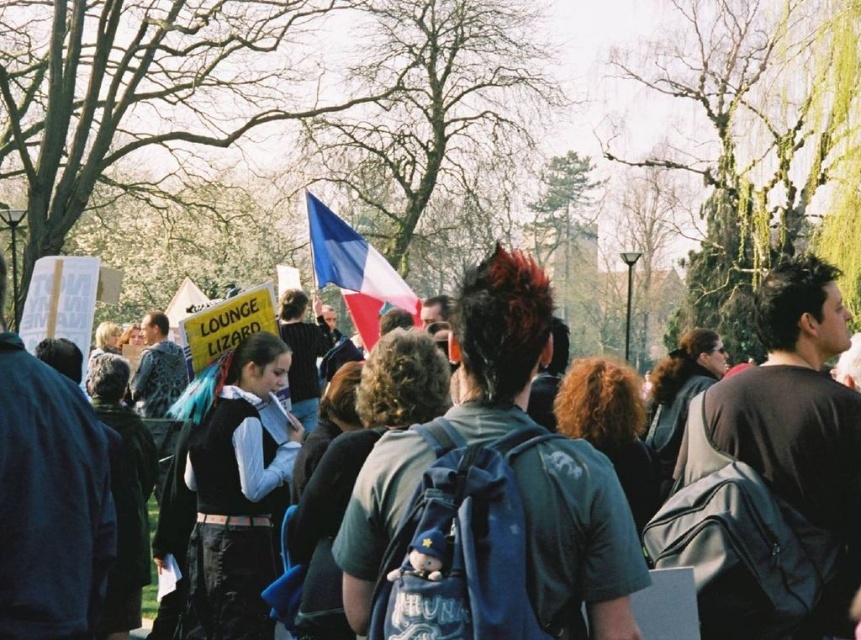
Question: Which of the following is the closest to the observer?

Choices:
 (A) (395, 272)
 (B) (369, 512)

Answer: (B)

Question: Is dark gray backpack at center positioned in front of blue fabric flag at center?

Choices:
 (A) yes
 (B) no

Answer: (A)

Question: Can you confirm if dark gray backpack at center is positioned below blue fabric flag at center?

Choices:
 (A) no
 (B) yes

Answer: (B)

Question: Does dark gray backpack at center appear on the left side of blue fabric flag at center?

Choices:
 (A) yes
 (B) no

Answer: (B)